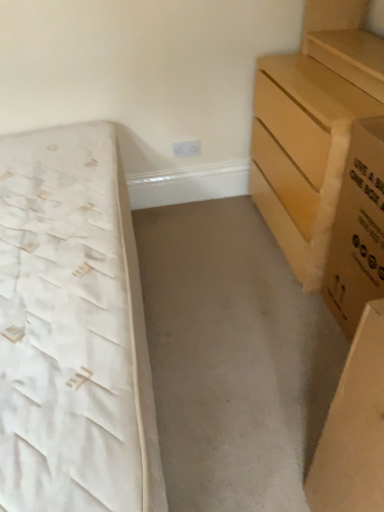
Question: Should I look upward or downward to see brown cardboard box at right?

Choices:
 (A) up
 (B) down

Answer: (A)

Question: From a real-world perspective, is light brown wooden chest of drawers at right below brown cardboard box at right?

Choices:
 (A) yes
 (B) no

Answer: (B)

Question: Does light brown wooden chest of drawers at right turn towards brown cardboard box at right?

Choices:
 (A) no
 (B) yes

Answer: (A)

Question: Can you confirm if light brown wooden chest of drawers at right is bigger than brown cardboard box at right?

Choices:
 (A) no
 (B) yes

Answer: (B)

Question: Considering the relative positions of light brown wooden chest of drawers at right and brown cardboard box at right in the image provided, is light brown wooden chest of drawers at right to the right of brown cardboard box at right from the viewer's perspective?

Choices:
 (A) no
 (B) yes

Answer: (A)

Question: Does light brown wooden chest of drawers at right appear on the left side of brown cardboard box at right?

Choices:
 (A) no
 (B) yes

Answer: (B)

Question: Can you confirm if light brown wooden chest of drawers at right is thinner than brown cardboard box at right?

Choices:
 (A) yes
 (B) no

Answer: (B)

Question: From a real-world perspective, is white fabric bed at left over light brown wooden chest of drawers at right?

Choices:
 (A) no
 (B) yes

Answer: (A)

Question: From a real-world perspective, is white fabric bed at left beneath light brown wooden chest of drawers at right?

Choices:
 (A) no
 (B) yes

Answer: (B)

Question: From the image's perspective, is white fabric bed at left under light brown wooden chest of drawers at right?

Choices:
 (A) no
 (B) yes

Answer: (B)

Question: Can you confirm if white fabric bed at left is bigger than light brown wooden chest of drawers at right?

Choices:
 (A) yes
 (B) no

Answer: (A)

Question: Considering the relative sizes of white fabric bed at left and light brown wooden chest of drawers at right in the image provided, is white fabric bed at left wider than light brown wooden chest of drawers at right?

Choices:
 (A) yes
 (B) no

Answer: (A)

Question: Is white fabric bed at left aimed at light brown wooden chest of drawers at right?

Choices:
 (A) yes
 (B) no

Answer: (B)

Question: Is brown cardboard box at right turned away from light brown wooden chest of drawers at right?

Choices:
 (A) no
 (B) yes

Answer: (A)